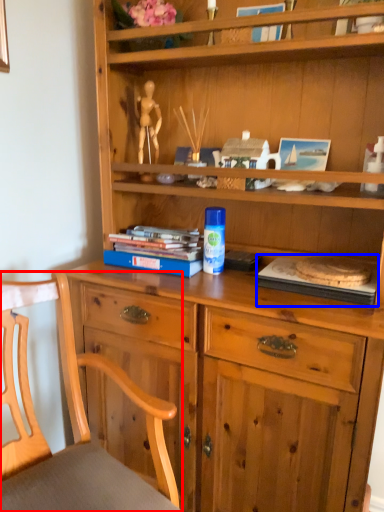
Question: Which object appears farthest to the camera in this image, chair (highlighted by a red box) or paperback book (highlighted by a blue box)?

Choices:
 (A) chair
 (B) paperback book

Answer: (B)